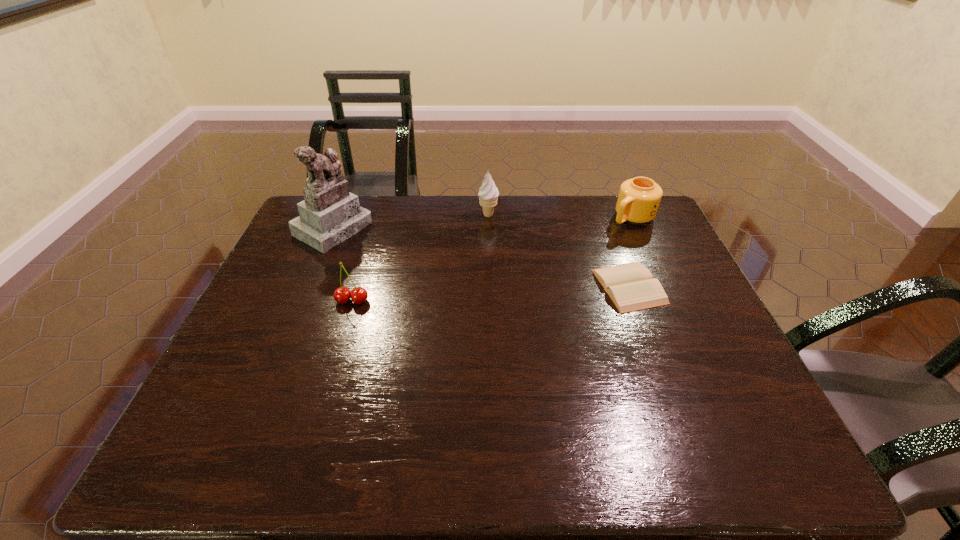
In order to click on object that is positioned at the left edge in this screenshot , I will do `click(329, 214)`.

Image resolution: width=960 pixels, height=540 pixels. What are the coordinates of `diary positioned at the right edge` in the screenshot? It's located at (630, 286).

You are a GUI agent. You are given a task and a screenshot of the screen. Output one action in this format:
    pyautogui.click(x=<x>, y=<y>)
    Task: Click on the mug that is at the right edge
    The image size is (960, 540).
    Given the screenshot: What is the action you would take?
    pyautogui.click(x=639, y=198)

This screenshot has height=540, width=960. What are the coordinates of `object that is at the far left corner` in the screenshot? It's located at (329, 214).

The image size is (960, 540). What are the coordinates of `object that is at the far right corner` in the screenshot? It's located at (639, 198).

This screenshot has height=540, width=960. What are the coordinates of `free space at the far edge of the desktop` in the screenshot? It's located at tap(406, 234).

The image size is (960, 540). I want to click on blank space at the near edge of the desktop, so [x=370, y=390].

The image size is (960, 540). Find the location of `vacant space at the left edge of the desktop`. vacant space at the left edge of the desktop is located at coordinates (276, 318).

You are a GUI agent. You are given a task and a screenshot of the screen. Output one action in this format:
    pyautogui.click(x=<x>, y=<y>)
    Task: Click on the free space at the right edge of the desktop
    The image size is (960, 540).
    Given the screenshot: What is the action you would take?
    pyautogui.click(x=683, y=258)

The image size is (960, 540). In the image, there is a desktop. What are the coordinates of `free space at the far right corner` in the screenshot? It's located at (629, 231).